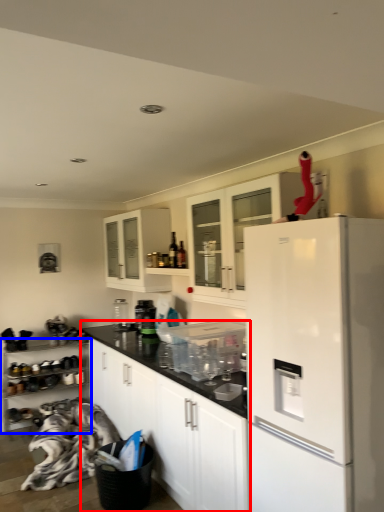
Question: Which of the following is the closest to the observer, cabinetry (highlighted by a red box) or cabinetry (highlighted by a blue box)?

Choices:
 (A) cabinetry
 (B) cabinetry

Answer: (A)